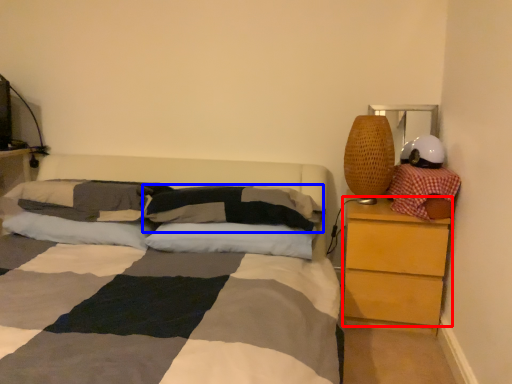
Question: Which of the following is the closest to the observer, chest of drawers (highlighted by a red box) or pillow (highlighted by a blue box)?

Choices:
 (A) chest of drawers
 (B) pillow

Answer: (B)